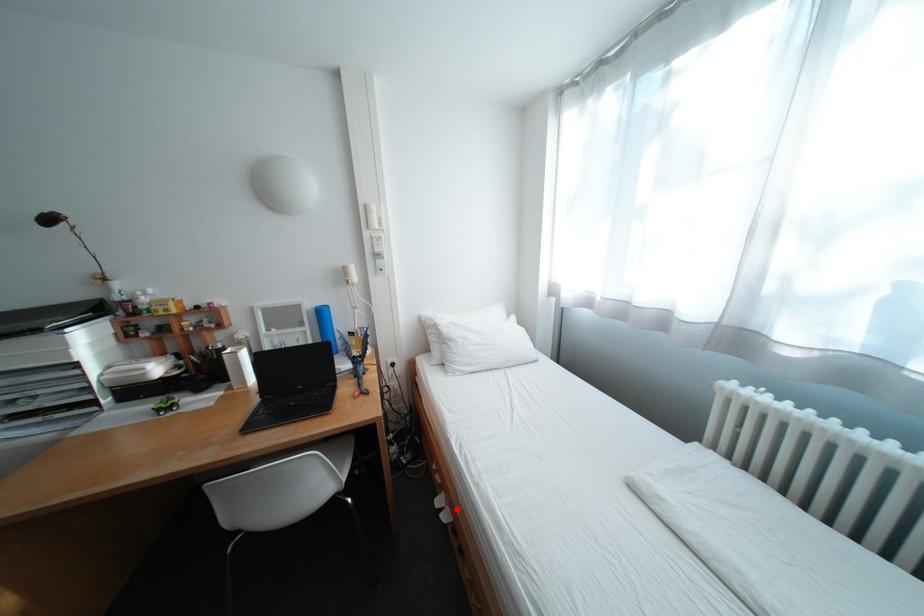
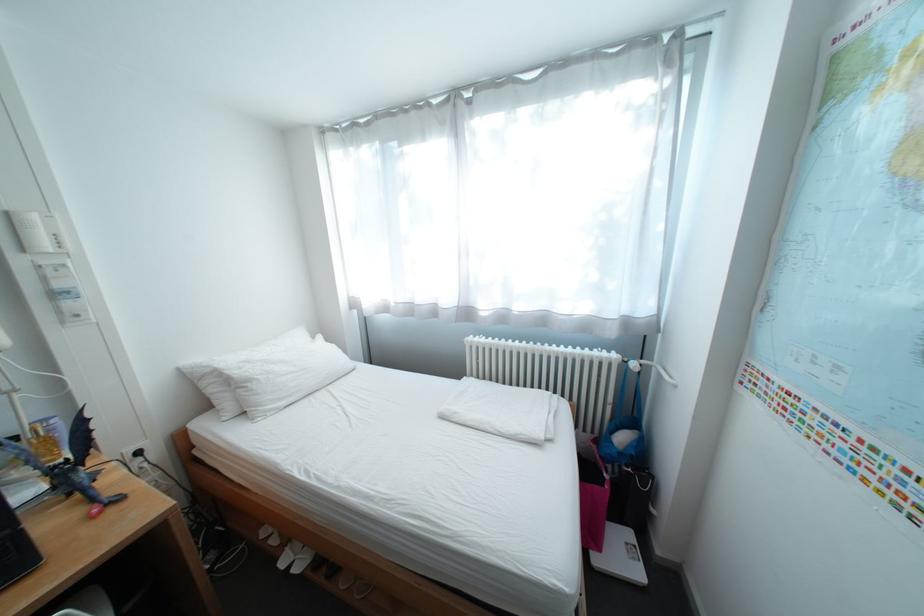
Find the pixel in the second image that matches the highlighted location in the first image.

(307, 562)